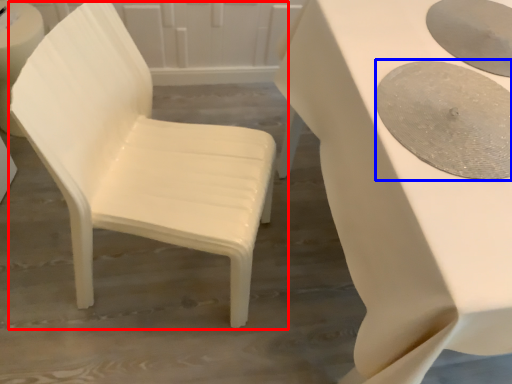
Question: Which of the following is the farthest to the observer, chair (highlighted by a red box) or oval (highlighted by a blue box)?

Choices:
 (A) chair
 (B) oval

Answer: (B)